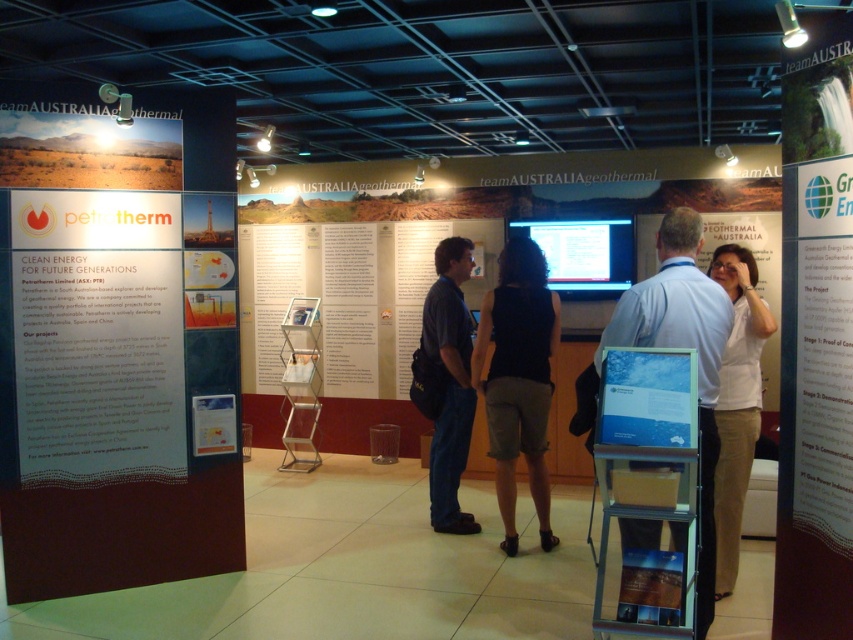
Question: Which object is the farthest from the white paper at center?

Choices:
 (A) black fabric dress at center
 (B) white cotton shirt at right

Answer: (A)

Question: In this image, where is black fabric dress at center located relative to dark blue shirt at center?

Choices:
 (A) above
 (B) below

Answer: (B)

Question: Which point is farther to the camera?

Choices:
 (A) (625, 323)
 (B) (628, 429)
 (C) (718, 458)
 (D) (62, 420)

Answer: (D)

Question: Does dark blue shirt at center have a lesser width compared to blue glossy poster at center?

Choices:
 (A) yes
 (B) no

Answer: (A)

Question: From the image, what is the correct spatial relationship of matte orange poster at upper left in relation to white cotton shirt at right?

Choices:
 (A) below
 (B) above

Answer: (B)

Question: Among these points, which one is nearest to the camera?

Choices:
 (A) (457, 445)
 (B) (494, 376)

Answer: (B)